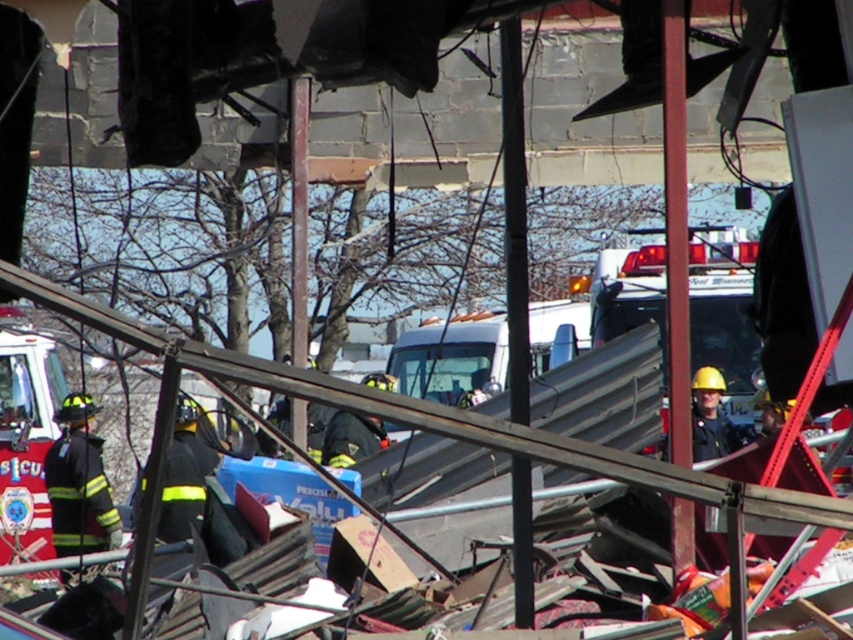
Question: Which object is closer to the camera taking this photo?

Choices:
 (A) black uniformed firefighter at left
 (B) red glossy fire truck at lower left

Answer: (A)

Question: Which point is farther to the camera?

Choices:
 (A) red glossy fire truck at lower left
 (B) black uniformed firefighter at left

Answer: (A)

Question: Which object appears closest to the camera in this image?

Choices:
 (A) black uniformed firefighter at left
 (B) red glossy fire truck at lower left

Answer: (A)

Question: Is red glossy fire truck at lower left thinner than black uniformed firefighter at left?

Choices:
 (A) yes
 (B) no

Answer: (B)

Question: Considering the relative positions of red glossy fire truck at lower left and black uniformed firefighter at left in the image provided, where is red glossy fire truck at lower left located with respect to black uniformed firefighter at left?

Choices:
 (A) above
 (B) below

Answer: (A)

Question: Can you confirm if red glossy fire truck at lower left is thinner than black uniformed firefighter at left?

Choices:
 (A) no
 (B) yes

Answer: (A)